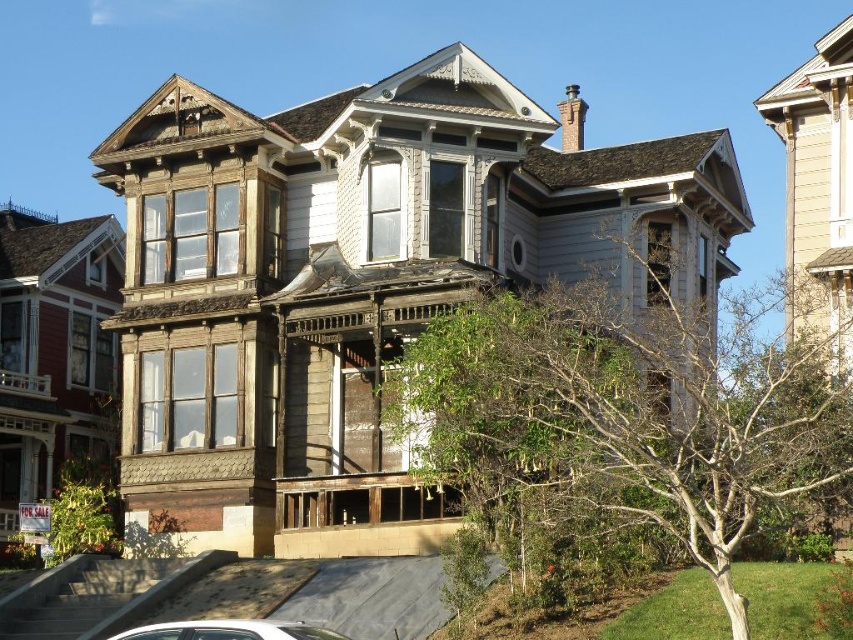
You are standing in front of the Victorian house and want to determine which of the two points, point (442, 372) or point (218, 632), is closer to you. Based on the image, which point is nearer?

Point (442, 372) is closer to you because it is further to the viewer than point (218, 632).

You are standing in front of the Victorian house and want to walk from the green leafy tree at center to the white glossy car at lower left. Which direction should you move relative to the tree?

Since the green leafy tree at center is further to the viewer than the white glossy car at lower left, you should move backward away from the tree towards the car.

You are standing in front of the Victorian house and notice a point marked at coordinates (624,412). What object is located at this point?

The point at (624,412) corresponds to the green leafy tree at center.